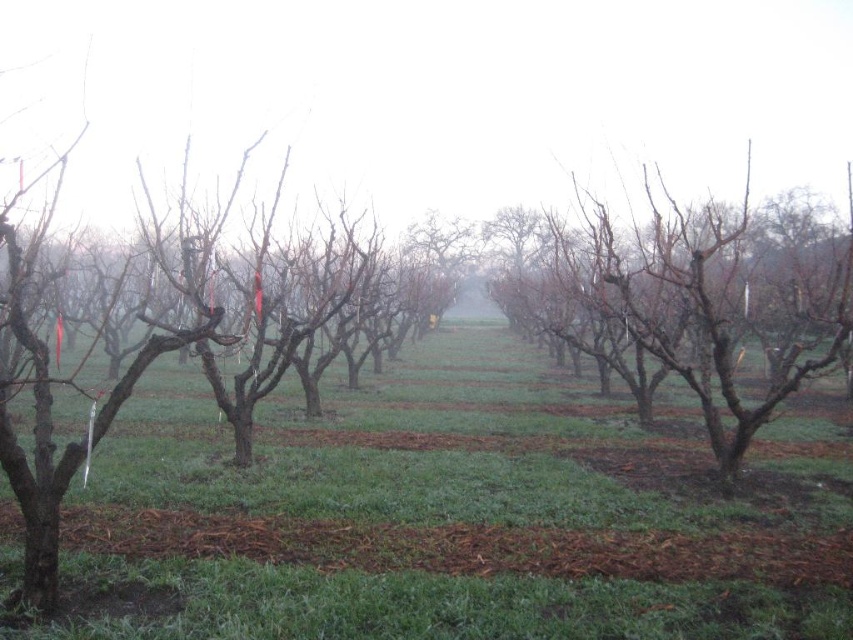
Is point (677, 536) positioned before point (704, 211)?

That is True.

Identify the location of green grass at center. This screenshot has height=640, width=853. (453, 513).